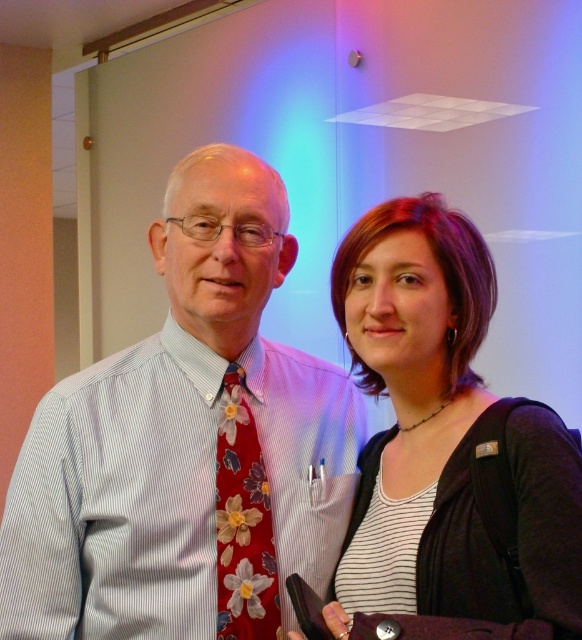
Question: Which object appears closest to the camera in this image?

Choices:
 (A) floral tie at center
 (B) floral silk tie at center
 (C) matte black backpack at center

Answer: (C)

Question: Which is nearer to the matte black backpack at center?

Choices:
 (A) floral silk tie at center
 (B) floral tie at center

Answer: (B)

Question: From the image, what is the correct spatial relationship of floral tie at center in relation to floral silk tie at center?

Choices:
 (A) left
 (B) right

Answer: (A)

Question: Which object is the closest to the floral tie at center?

Choices:
 (A) floral silk tie at center
 (B) matte black backpack at center

Answer: (A)

Question: Does matte black backpack at center appear over floral silk tie at center?

Choices:
 (A) no
 (B) yes

Answer: (B)

Question: Is floral tie at center thinner than matte black backpack at center?

Choices:
 (A) yes
 (B) no

Answer: (B)